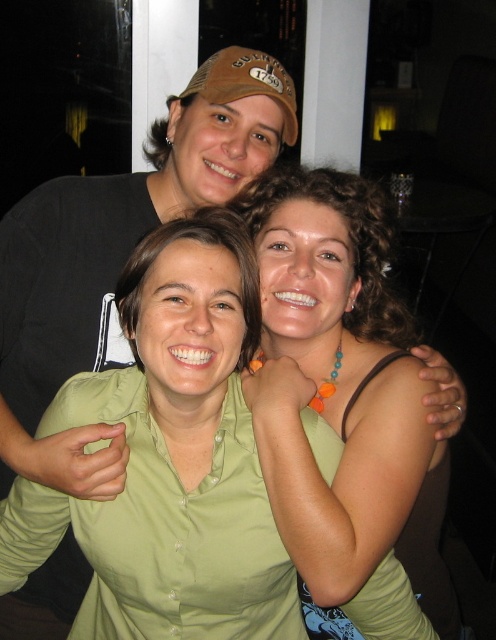
Question: Which point is farther to the camera?

Choices:
 (A) (330, 444)
 (B) (257, 236)

Answer: (B)

Question: Does green fabric shirt at center come behind brown fabric baseball cap at upper center?

Choices:
 (A) no
 (B) yes

Answer: (A)

Question: Does green matte shirt at center appear on the left side of brown fabric baseball cap at upper center?

Choices:
 (A) yes
 (B) no

Answer: (A)

Question: Where is green matte shirt at center located in relation to green fabric shirt at center in the image?

Choices:
 (A) right
 (B) left

Answer: (B)

Question: Estimate the real-world distances between objects in this image. Which object is closer to the brown fabric baseball cap at upper center?

Choices:
 (A) green fabric shirt at center
 (B) green matte shirt at center

Answer: (A)

Question: Estimate the real-world distances between objects in this image. Which object is closer to the green matte shirt at center?

Choices:
 (A) brown fabric baseball cap at upper center
 (B) green fabric shirt at center

Answer: (B)